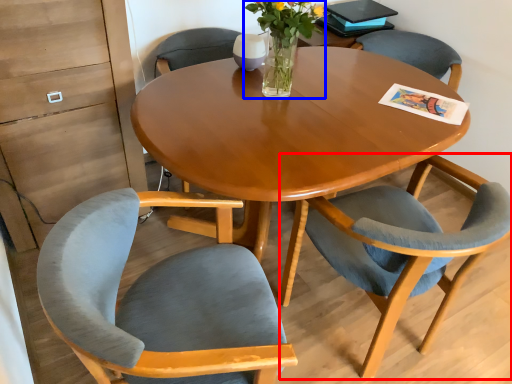
Question: Which object appears farthest to the camera in this image, chair (highlighted by a red box) or floral arrangement (highlighted by a blue box)?

Choices:
 (A) chair
 (B) floral arrangement

Answer: (B)